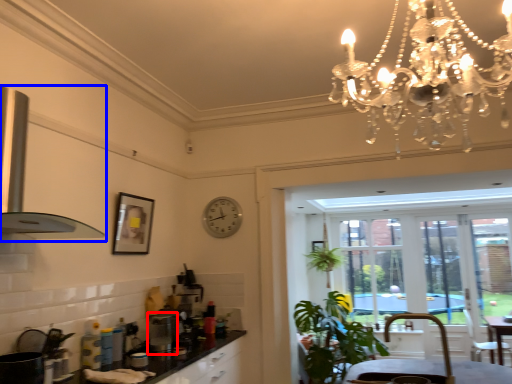
Question: Which of the following is the farthest to the observer, appliance (highlighted by a red box) or exhaust hood (highlighted by a blue box)?

Choices:
 (A) appliance
 (B) exhaust hood

Answer: (A)